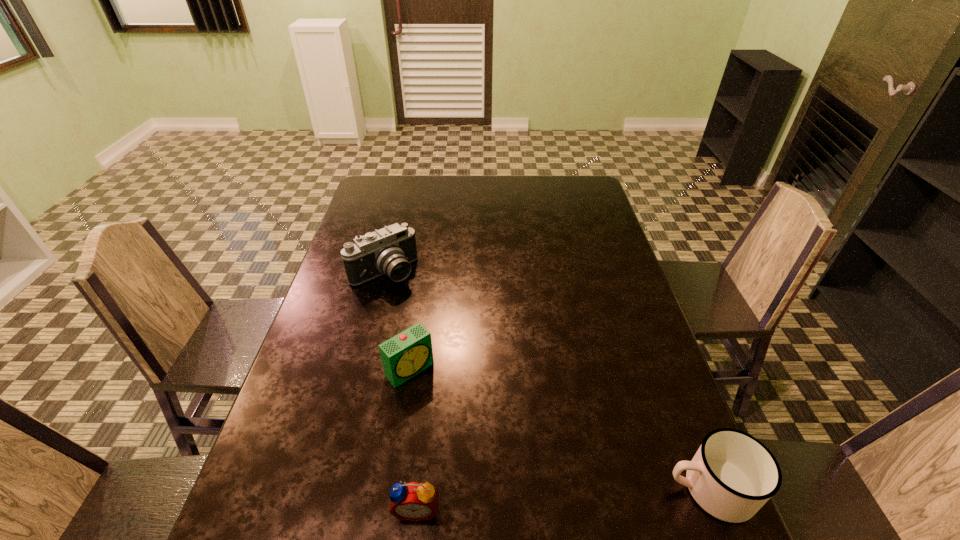
At what (x,y) coordinates should I click in order to perform the action: click on the nearer alarm clock. Please return your answer as a coordinate pair (x, y). Looking at the image, I should click on (413, 501).

Find the location of `the rightmost object`. the rightmost object is located at coordinates (732, 475).

Locate an element on the screen. This screenshot has height=540, width=960. the tallest object is located at coordinates (390, 250).

Where is `the farthest object`? This screenshot has width=960, height=540. the farthest object is located at coordinates (390, 250).

The height and width of the screenshot is (540, 960). I want to click on the farther alarm clock, so click(x=403, y=356).

You are a GUI agent. You are given a task and a screenshot of the screen. Output one action in this format:
    pyautogui.click(x=<x>, y=<y>)
    Task: Click on the free spot located on the side of the mug with the handle
    This screenshot has height=540, width=960.
    Given the screenshot: What is the action you would take?
    pyautogui.click(x=533, y=489)

Identify the location of vacant space located 0.270m on the side of the mug with the handle. This screenshot has width=960, height=540. (528, 489).

The height and width of the screenshot is (540, 960). Identify the location of vacant space located on the side of the mug with the handle. (517, 489).

You are a GUI agent. You are given a task and a screenshot of the screen. Output one action in this format:
    pyautogui.click(x=<x>, y=<y>)
    Task: Click on the free spot located 0.370m on the front-facing side of the camera
    The image size is (960, 540).
    Given the screenshot: What is the action you would take?
    pyautogui.click(x=472, y=369)

The width and height of the screenshot is (960, 540). I want to click on vacant space positioned 0.150m on the front-facing side of the camera, so click(426, 317).